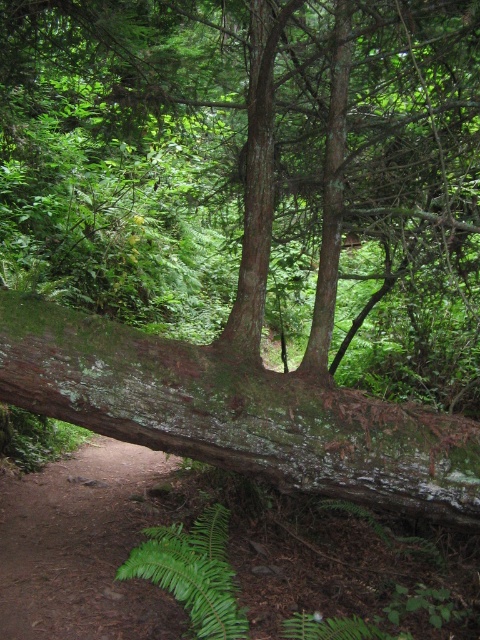
Question: Which point is closer to the camera?

Choices:
 (A) (45, 369)
 (B) (204, 545)

Answer: (B)

Question: Does green mossy log at center have a greater width compared to green leafy fern at lower center?

Choices:
 (A) no
 (B) yes

Answer: (B)

Question: From the image, what is the correct spatial relationship of green mossy log at center in relation to green leafy fern at lower center?

Choices:
 (A) below
 (B) above

Answer: (B)

Question: Does green mossy log at center have a greater width compared to green leafy fern at lower center?

Choices:
 (A) yes
 (B) no

Answer: (A)